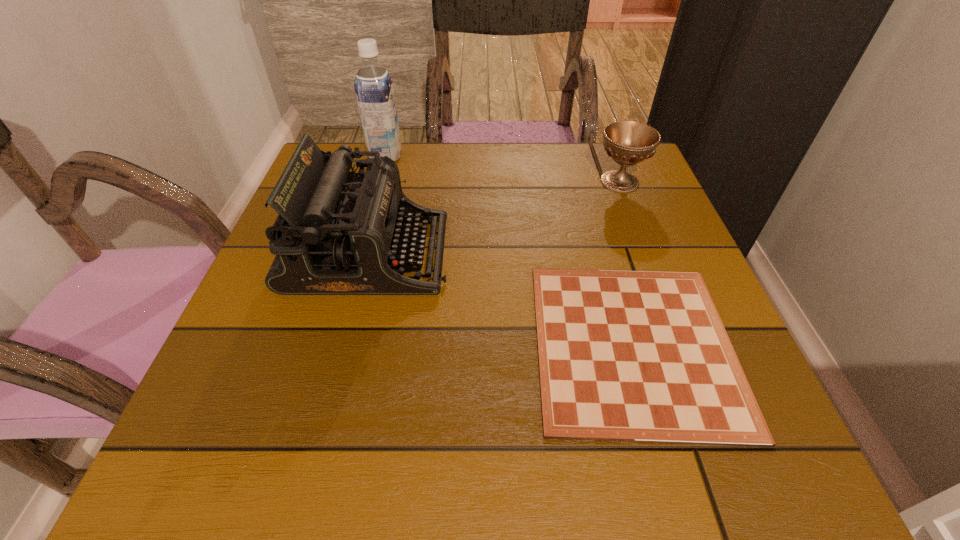
This screenshot has height=540, width=960. I want to click on free region at the far edge of the desktop, so click(496, 196).

In the image, there is a desktop. Where is `vacant region at the near edge`? This screenshot has width=960, height=540. vacant region at the near edge is located at coordinates (341, 435).

The image size is (960, 540). Identify the location of vacant space at the left edge. (263, 373).

At what (x,y) coordinates should I click in order to perform the action: click on free space at the near left corner of the desktop. Please return your answer as a coordinate pair (x, y). The image size is (960, 540). Looking at the image, I should click on (195, 479).

Identify the location of free space at the far right corner. (644, 170).

Where is `vacant area that lies between the checkerboard and the typewriter`? vacant area that lies between the checkerboard and the typewriter is located at coordinates (501, 299).

The width and height of the screenshot is (960, 540). I want to click on vacant space in between the third tallest object and the tallest object, so click(503, 169).

Find the location of a particular element. The width and height of the screenshot is (960, 540). free space between the tallest object and the shortest object is located at coordinates (510, 250).

Find the location of `free space between the second shortest object and the checkerboard`. free space between the second shortest object and the checkerboard is located at coordinates (627, 263).

Locate an element on the screen. empty space that is in between the farthest object and the third nearest object is located at coordinates (503, 169).